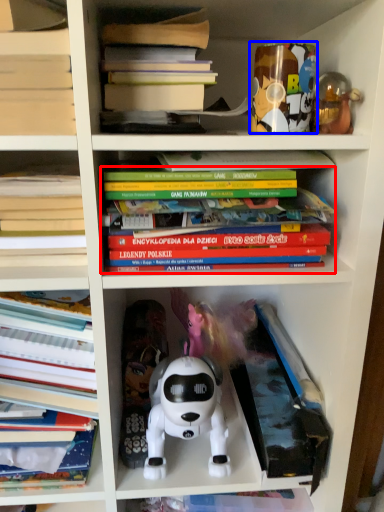
Question: Among these objects, which one is farthest to the camera, book (highlighted by a red box) or toy (highlighted by a blue box)?

Choices:
 (A) book
 (B) toy

Answer: (B)